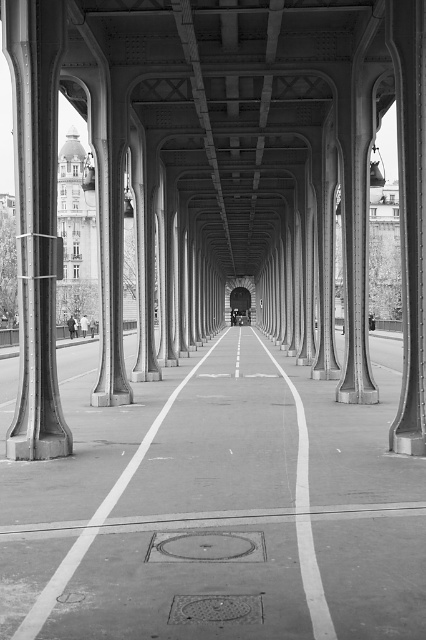
Find the location of a particular element. This screenshot has width=426, height=640. white concrete line at center is located at coordinates (305, 518).

Does white concrete line at center appear over white glossy line at center?

No.

Which is in front, point (294, 404) or point (236, 372)?

Point (294, 404)

Where is `white concrete line at center`? This screenshot has width=426, height=640. white concrete line at center is located at coordinates (305, 518).

Who is more forward, (141, 444) or (276, 368)?

Positioned in front is point (141, 444).

Looking at this image, is smooth concrete line at center to the right of white concrete line at center from the viewer's perspective?

No, smooth concrete line at center is not to the right of white concrete line at center.

What are the coordinates of `smooth concrete line at center` in the screenshot? It's located at (95, 522).

Can you confirm if smooth concrete line at center is positioned to the left of white glossy line at center?

Yes, smooth concrete line at center is to the left of white glossy line at center.

The width and height of the screenshot is (426, 640). What do you see at coordinates (95, 522) in the screenshot?
I see `smooth concrete line at center` at bounding box center [95, 522].

You are a GUI agent. You are given a task and a screenshot of the screen. Output one action in this format:
    pyautogui.click(x=<x>, y=<y>)
    Task: Click on the smooth concrete line at center
    
    Given the screenshot: What is the action you would take?
    pyautogui.click(x=95, y=522)